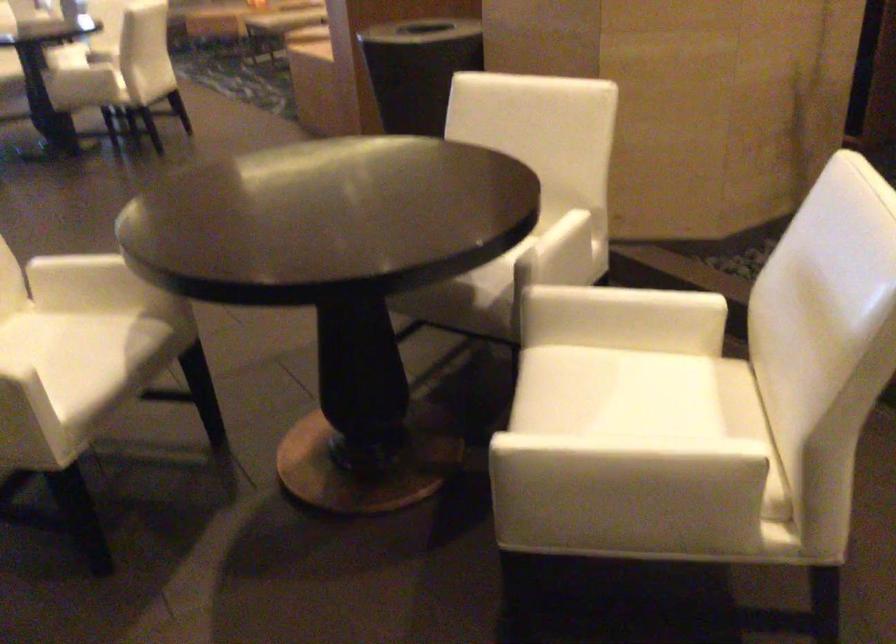
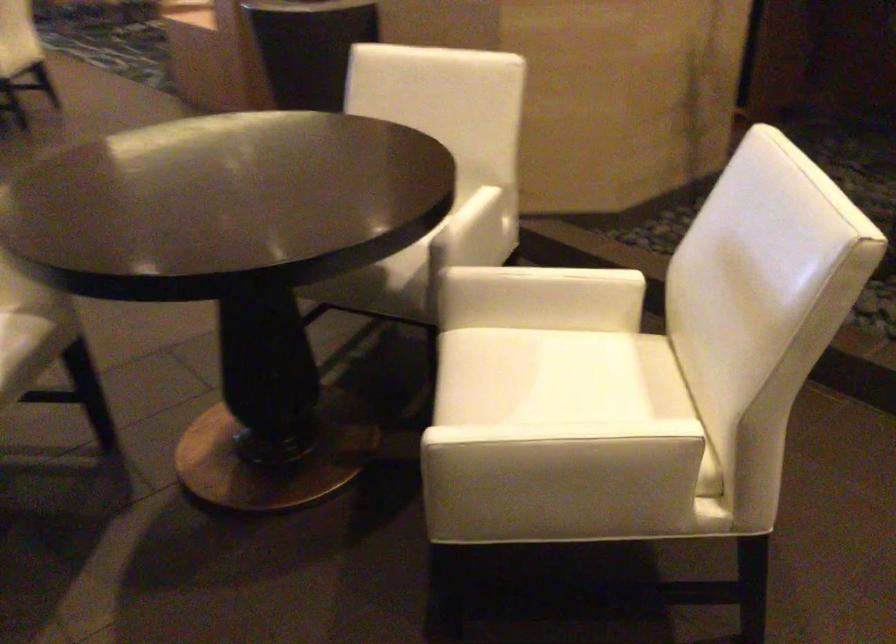
Which direction would the cameraman need to move to produce the second image?

The cameraman moved toward left, forward.